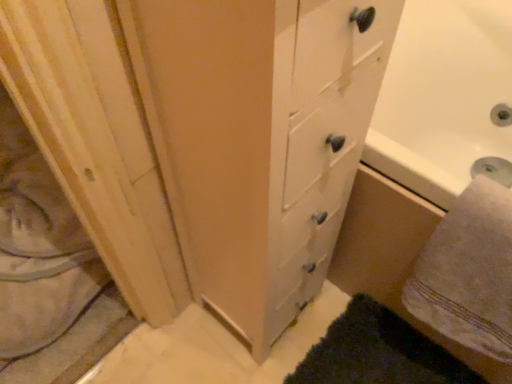
Question: Does point (111, 152) appear closer or farther from the camera than point (472, 301)?

Choices:
 (A) closer
 (B) farther

Answer: (A)

Question: From a real-world perspective, is natural wood screen door at left physically located above or below white soft towel at lower right?

Choices:
 (A) above
 (B) below

Answer: (B)

Question: Is natural wood screen door at left taller or shorter than white soft towel at lower right?

Choices:
 (A) short
 (B) tall

Answer: (A)

Question: Considering the positions of white soft towel at lower right and natural wood screen door at left in the image, is white soft towel at lower right wider or thinner than natural wood screen door at left?

Choices:
 (A) wide
 (B) thin

Answer: (B)

Question: From a real-world perspective, is white soft towel at lower right positioned above or below natural wood screen door at left?

Choices:
 (A) above
 (B) below

Answer: (A)

Question: Is point (487, 201) closer or farther from the camera than point (97, 59)?

Choices:
 (A) closer
 (B) farther

Answer: (B)

Question: Which is correct: white soft towel at lower right is inside natural wood screen door at left, or outside of it?

Choices:
 (A) outside
 (B) inside

Answer: (A)